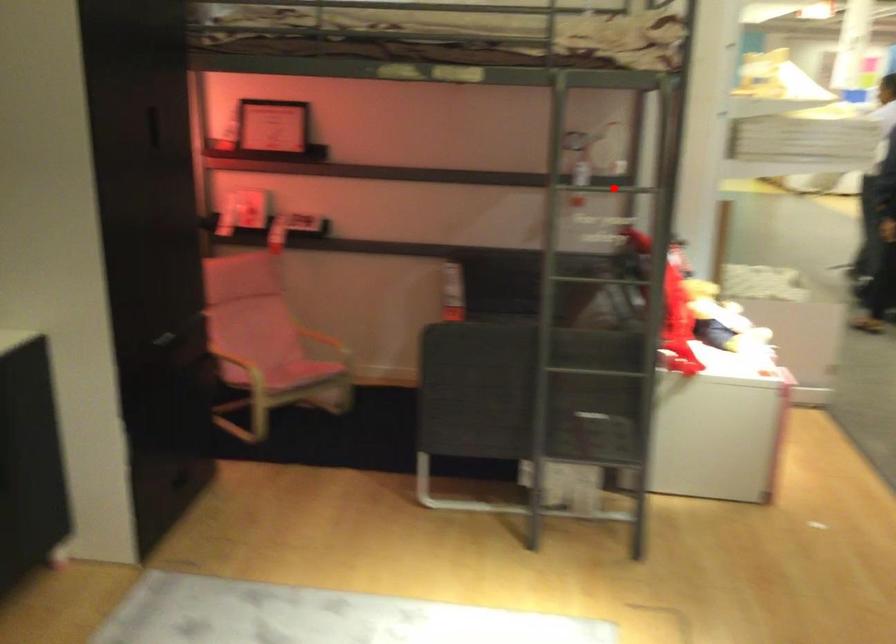
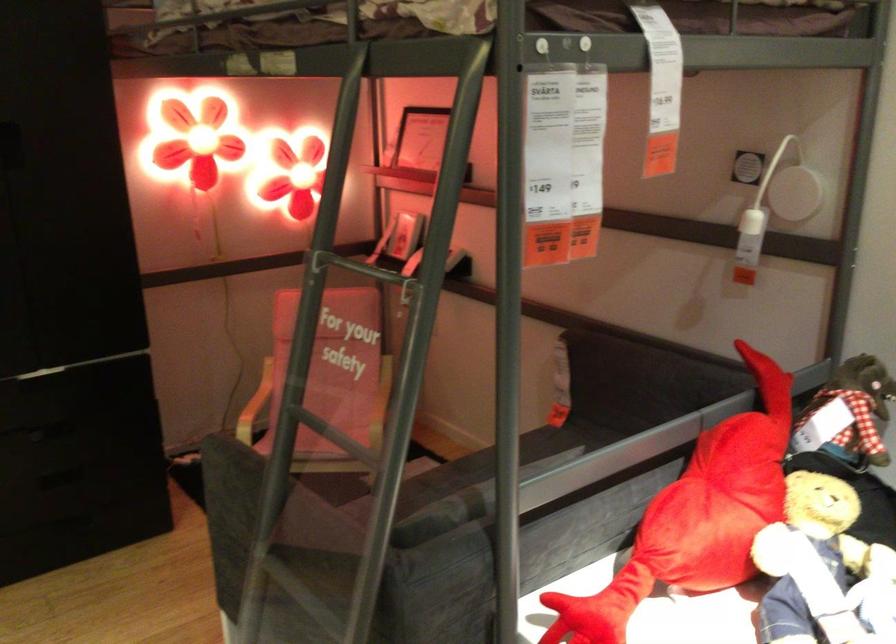
Find the pixel in the second image that matches the highlighted location in the first image.

(354, 267)